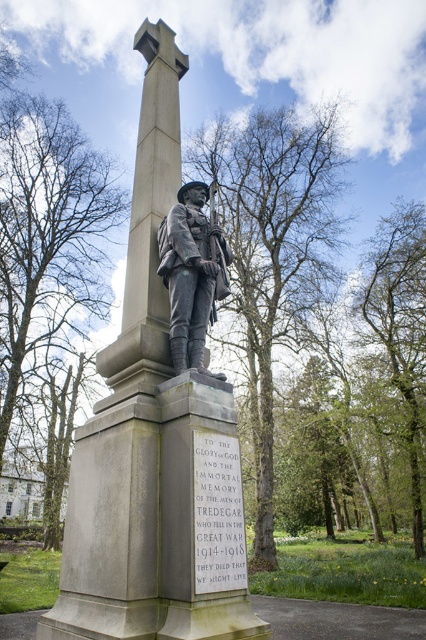
Question: Which point is farther to the camera?

Choices:
 (A) (184, 284)
 (B) (51, 628)

Answer: (A)

Question: Is gray stone statue at center positioned in front of bronze statue at center?

Choices:
 (A) yes
 (B) no

Answer: (A)

Question: Which of the following is the closest to the observer?

Choices:
 (A) gray stone statue at center
 (B) bronze statue at center

Answer: (A)

Question: Can you confirm if gray stone statue at center is positioned below bronze statue at center?

Choices:
 (A) yes
 (B) no

Answer: (B)

Question: Among these objects, which one is farthest from the camera?

Choices:
 (A) bronze statue at center
 (B) gray stone statue at center

Answer: (A)

Question: Is gray stone statue at center below bronze statue at center?

Choices:
 (A) yes
 (B) no

Answer: (B)